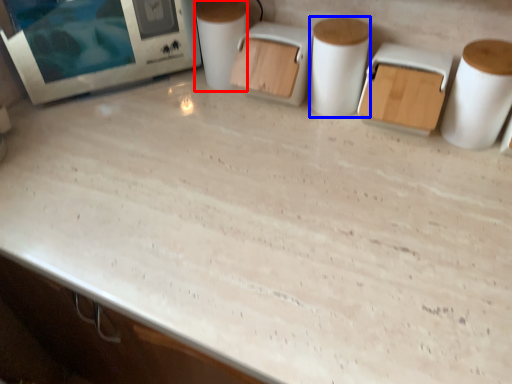
Question: Which of the following is the farthest to the observer, toilet paper (highlighted by a red box) or paper towel (highlighted by a blue box)?

Choices:
 (A) toilet paper
 (B) paper towel

Answer: (A)